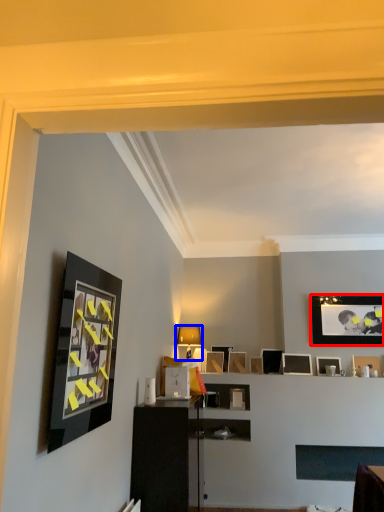
Question: Among these objects, which one is nearest to the camera, picture frame (highlighted by a red box) or table lamp (highlighted by a blue box)?

Choices:
 (A) picture frame
 (B) table lamp

Answer: (B)